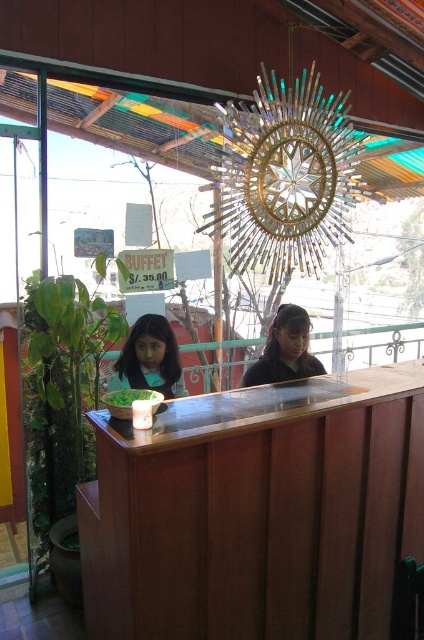
Which is above, matte black hair at center or green leafy vegetable at center?

Positioned higher is matte black hair at center.

Does matte black hair at center come in front of green leafy vegetable at center?

No, matte black hair at center is further to the viewer.

Does point (153, 330) lie behind point (145, 392)?

Yes, point (153, 330) is farther from viewer.

Image resolution: width=424 pixels, height=640 pixels. In order to click on matte black hair at center in this screenshot , I will do `click(148, 358)`.

Is brown wood table at center thinner than matte black shirt at center?

No, brown wood table at center is not thinner than matte black shirt at center.

Looking at this image, who is more distant from viewer, (159, 541) or (300, 321)?

Positioned behind is point (300, 321).

I want to click on brown wood table at center, so click(x=256, y=512).

Is point (318, 436) behind point (153, 403)?

Yes, it is.

Which is in front, point (105, 497) or point (161, 401)?

Point (105, 497) is more forward.

I want to click on brown wood table at center, so pos(256,512).